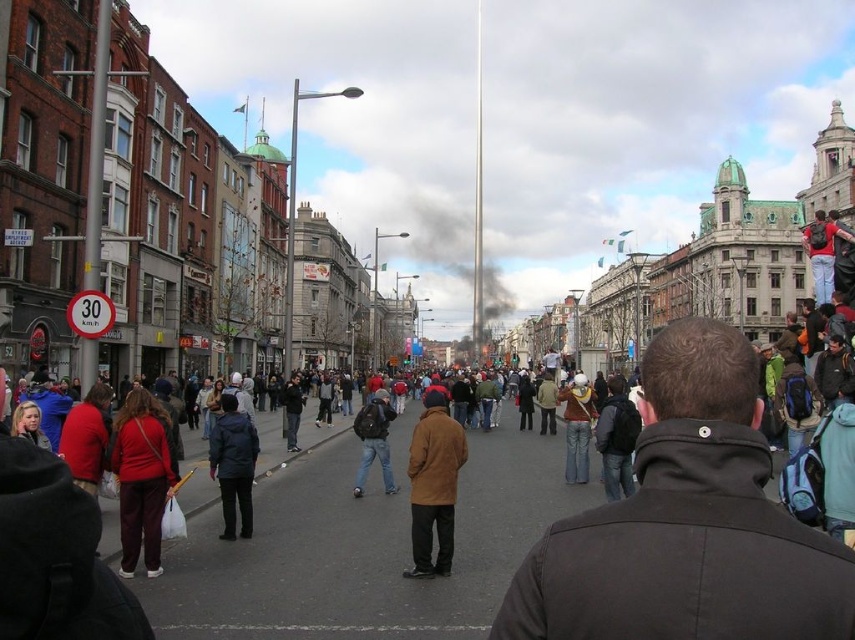
Question: Is matte red jacket at lower left behind red backpack at center?

Choices:
 (A) no
 (B) yes

Answer: (A)

Question: Can you confirm if matte red jacket at lower left is wider than matte black backpack at center?

Choices:
 (A) no
 (B) yes

Answer: (B)

Question: Among these objects, which one is nearest to the camera?

Choices:
 (A) matte black backpack at center
 (B) brown leather jacket at center
 (C) dark blue jacket at center

Answer: (B)

Question: Is brown leather jacket at center to the right of matte red jacket at lower left from the viewer's perspective?

Choices:
 (A) no
 (B) yes

Answer: (B)

Question: Estimate the real-world distances between objects in this image. Which object is closer to the dark blue jacket at center?

Choices:
 (A) red backpack at center
 (B) matte red jacket at lower left
 (C) matte black backpack at center

Answer: (B)

Question: Among these points, which one is farthest from the camera?

Choices:
 (A) (378, 458)
 (B) (151, 548)

Answer: (A)